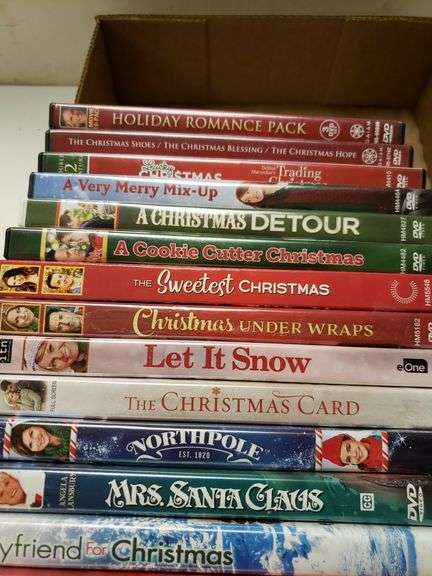
The width and height of the screenshot is (432, 576). I want to click on red dvd movie cases, so click(260, 328), click(282, 295), click(275, 168), click(276, 151), click(274, 123).